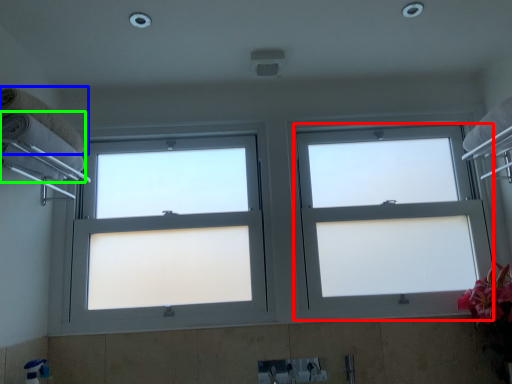
Question: Which object is positioned farthest from window (highlighted by a red box)? Select from towel (highlighted by a blue box) and towel (highlighted by a green box).

Choices:
 (A) towel
 (B) towel

Answer: (A)